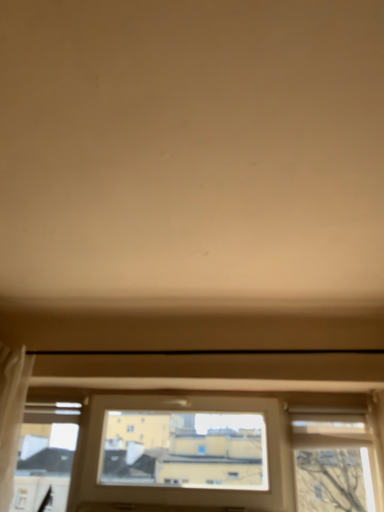
Question: From the image's perspective, is transparent glass window at bottom above or below white sheer curtain at left?

Choices:
 (A) above
 (B) below

Answer: (B)

Question: Based on their sizes in the image, would you say transparent glass window at bottom is bigger or smaller than white sheer curtain at left?

Choices:
 (A) big
 (B) small

Answer: (A)

Question: Is transparent glass window at bottom inside the boundaries of white sheer curtain at left, or outside?

Choices:
 (A) outside
 (B) inside

Answer: (A)

Question: In the image, is white sheer curtain at left positioned in front of or behind transparent glass window at bottom?

Choices:
 (A) behind
 (B) front

Answer: (B)

Question: From a real-world perspective, is white sheer curtain at left above or below transparent glass window at bottom?

Choices:
 (A) above
 (B) below

Answer: (A)

Question: Visually, is white sheer curtain at left positioned to the left or to the right of transparent glass window at bottom?

Choices:
 (A) right
 (B) left

Answer: (B)

Question: From the image's perspective, is white sheer curtain at left located above or below transparent glass window at bottom?

Choices:
 (A) below
 (B) above

Answer: (B)